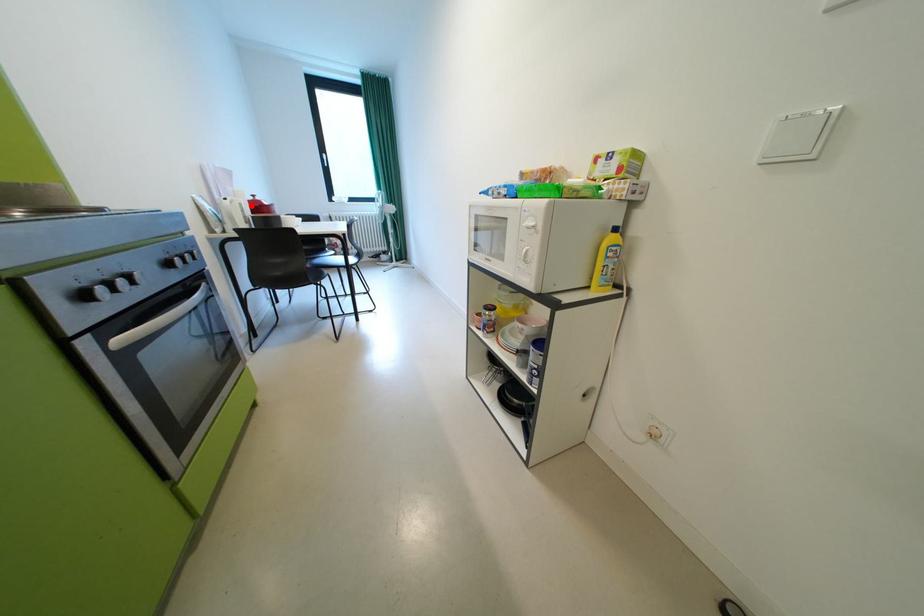
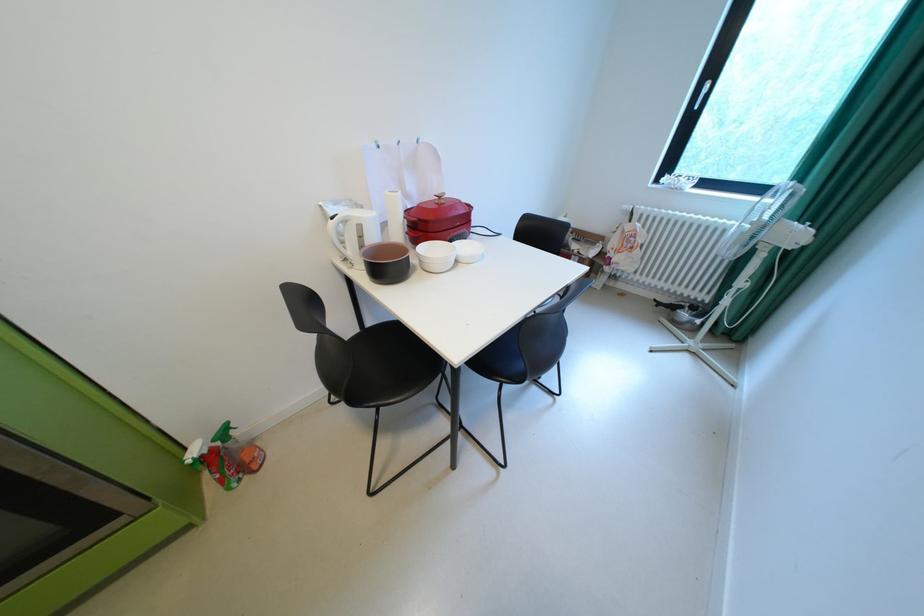
Where in the second image is the point corresponding to the highlighted location from the first image?

(370, 227)